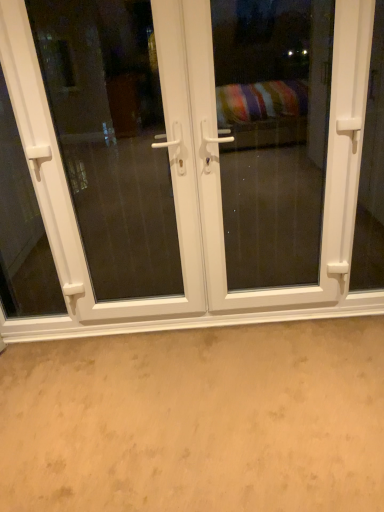
Question: Does beige carpet at lower center have a greater height compared to white plastic screen door at center, arranged as the second screen door when viewed from the left?

Choices:
 (A) yes
 (B) no

Answer: (B)

Question: From a real-world perspective, does beige carpet at lower center stand above white plastic screen door at center, arranged as the second screen door when viewed from the left?

Choices:
 (A) no
 (B) yes

Answer: (A)

Question: Is beige carpet at lower center wider than white plastic screen door at center, which appears as the first screen door when viewed from the right?

Choices:
 (A) no
 (B) yes

Answer: (B)

Question: Are beige carpet at lower center and white plastic screen door at center, arranged as the second screen door when viewed from the left, far apart?

Choices:
 (A) no
 (B) yes

Answer: (B)

Question: From the image's perspective, would you say beige carpet at lower center is shown under white plastic screen door at center, which appears as the first screen door when viewed from the right?

Choices:
 (A) no
 (B) yes

Answer: (B)

Question: Based on their sizes in the image, would you say beige carpet at lower center is bigger or smaller than white plastic handle at left?

Choices:
 (A) small
 (B) big

Answer: (B)

Question: From a real-world perspective, is beige carpet at lower center positioned above or below white plastic handle at left?

Choices:
 (A) below
 (B) above

Answer: (A)

Question: Does point (56, 413) appear closer or farther from the camera than point (54, 312)?

Choices:
 (A) closer
 (B) farther

Answer: (A)

Question: From the image's perspective, is beige carpet at lower center located above or below white plastic handle at left?

Choices:
 (A) below
 (B) above

Answer: (A)

Question: From a real-world perspective, is white plastic door at center above or below white plastic screen door at center, arranged as the second screen door when viewed from the left?

Choices:
 (A) above
 (B) below

Answer: (B)

Question: Is white plastic door at center to the left or to the right of white plastic screen door at center, arranged as the second screen door when viewed from the left, in the image?

Choices:
 (A) right
 (B) left

Answer: (B)

Question: Is point (51, 183) closer or farther from the camera than point (236, 243)?

Choices:
 (A) farther
 (B) closer

Answer: (B)

Question: Looking at the image, does white plastic door at center seem bigger or smaller compared to white plastic screen door at center, arranged as the second screen door when viewed from the left?

Choices:
 (A) big
 (B) small

Answer: (A)

Question: From the image's perspective, relative to white plastic handle at left, is white plastic screen door at center, positioned as the 2th screen door in right-to-left order, above or below?

Choices:
 (A) below
 (B) above

Answer: (B)

Question: Looking at the image, does white plastic screen door at center, acting as the first screen door starting from the left, seem bigger or smaller compared to white plastic handle at left?

Choices:
 (A) small
 (B) big

Answer: (B)